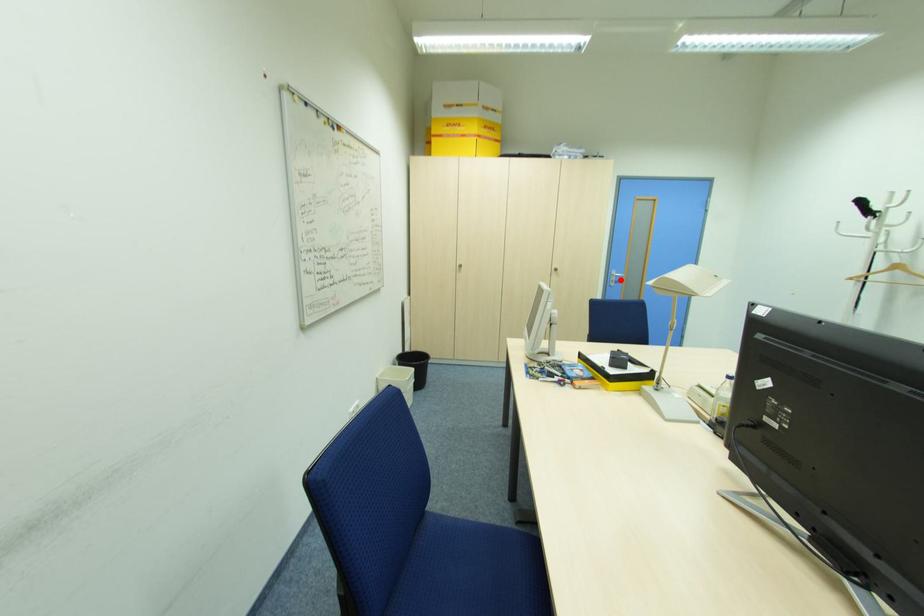
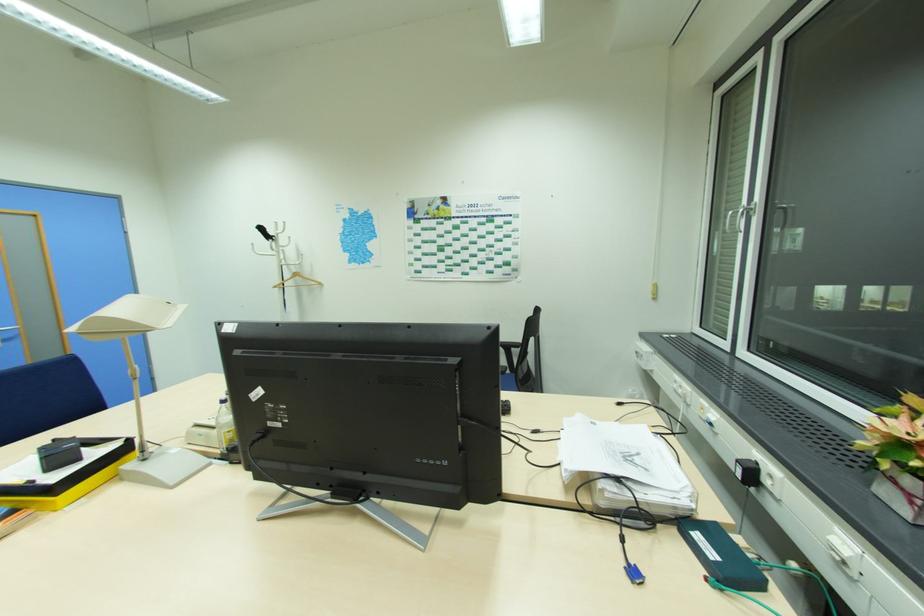
Locate, in the second image, the point that corresponds to the highlighted location in the first image.

(11, 337)